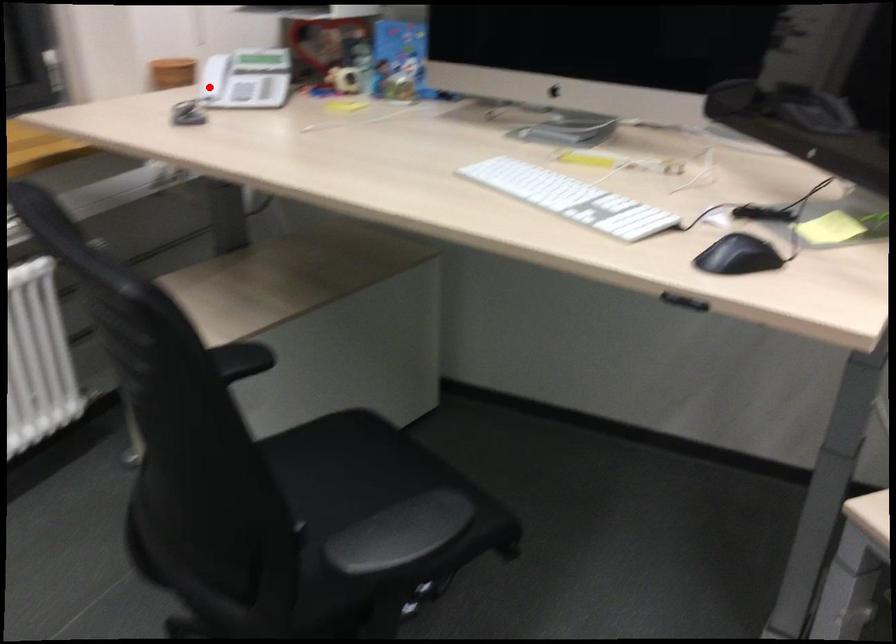
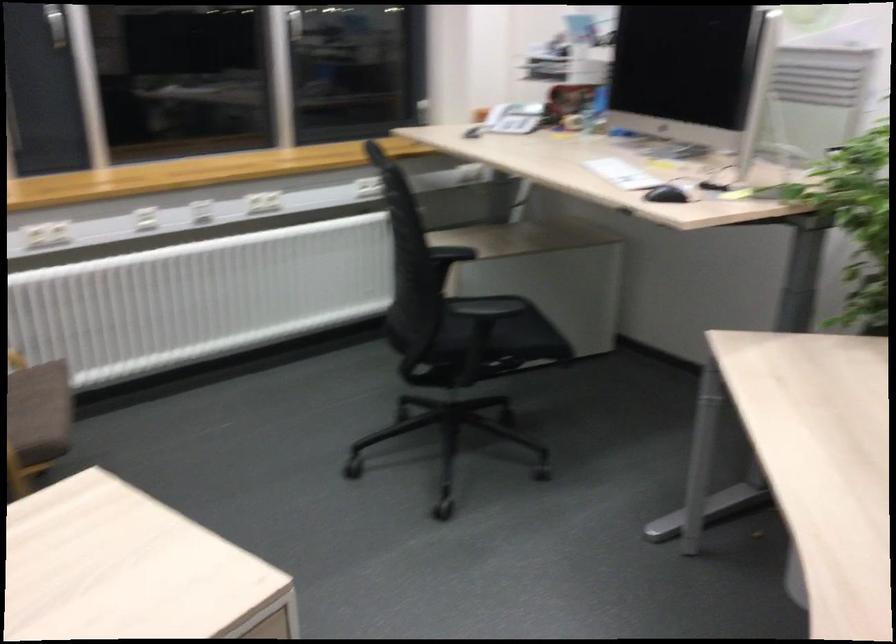
Question: I am providing you with two images of the same scene from different viewpoints. In image1, a red point is highlighted. Considering the same 3D point in image2, which of the following is correct?

Choices:
 (A) It is closer
 (B) It is farther

Answer: (B)